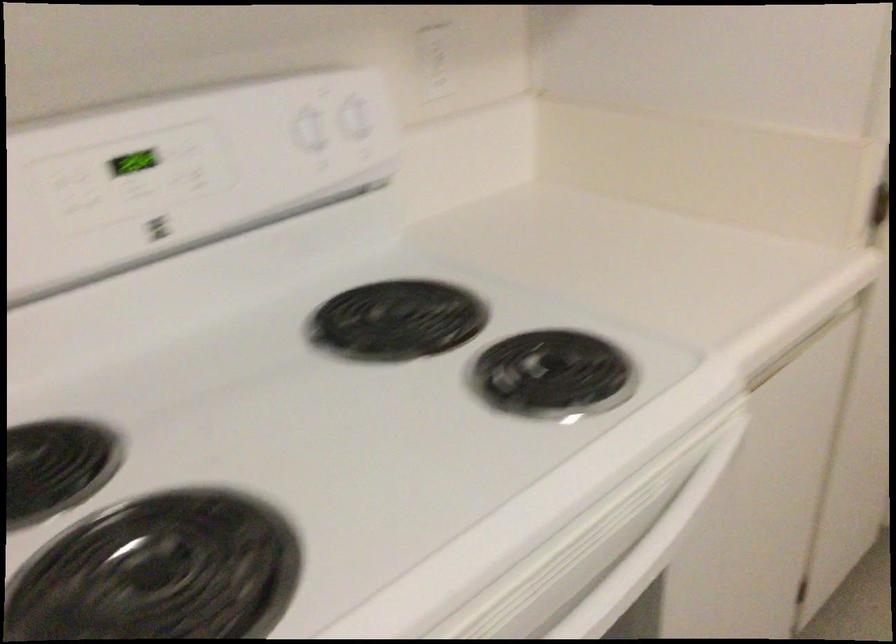
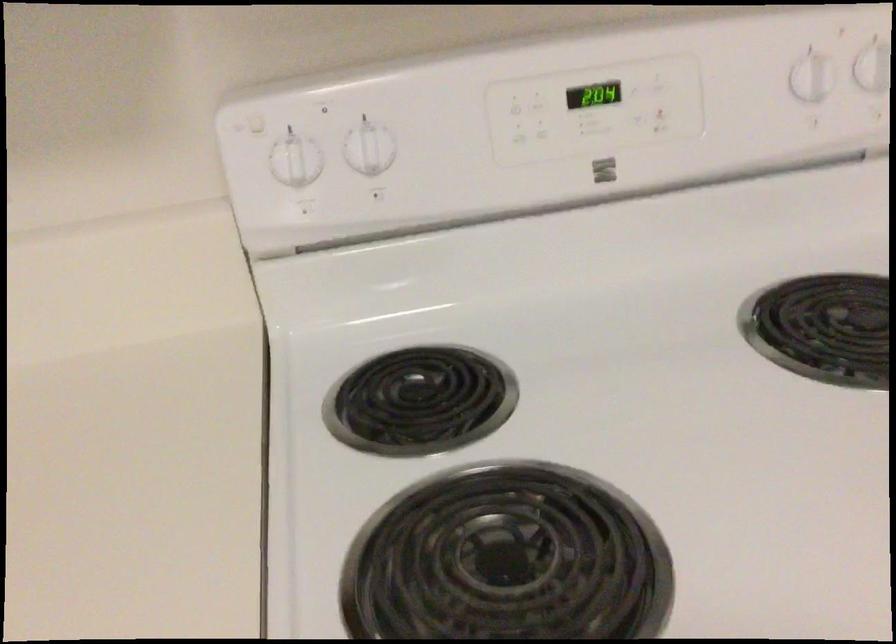
Find the pixel in the second image that matches point 314,140 in the first image.

(810, 77)